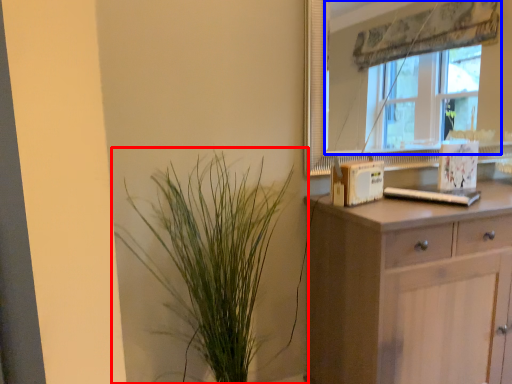
Question: Which point is further to the camera, houseplant (highlighted by a red box) or window (highlighted by a blue box)?

Choices:
 (A) houseplant
 (B) window

Answer: (B)